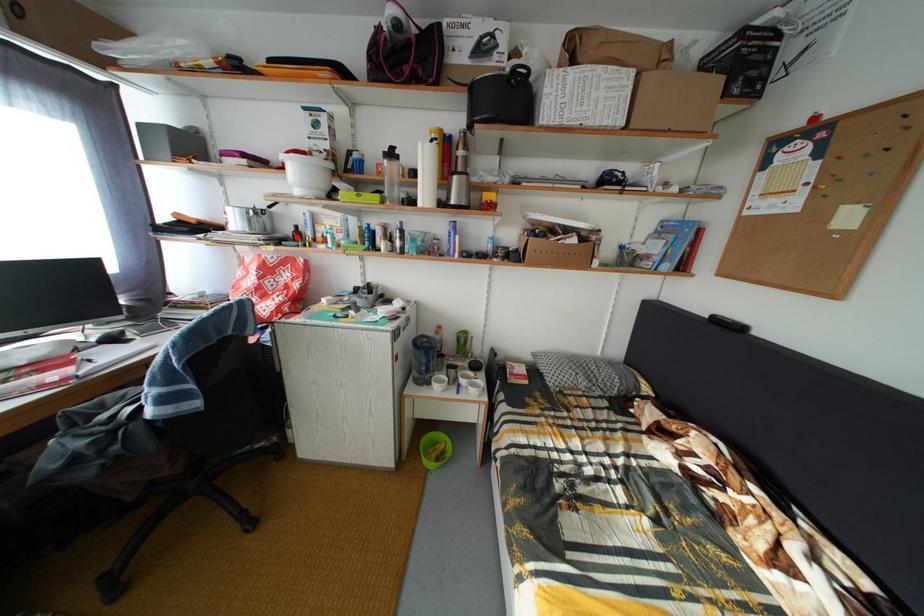
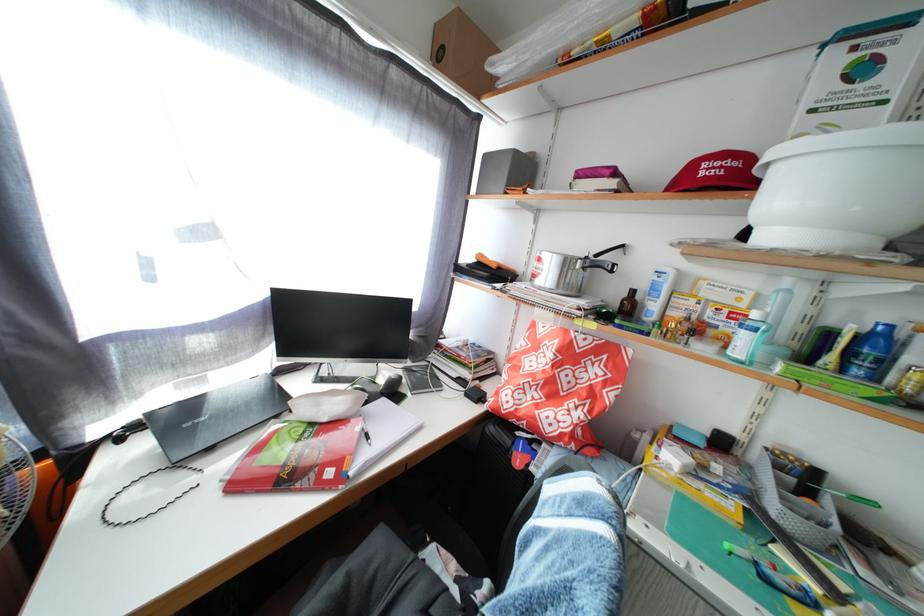
Locate, in the second image, the point that corresponds to the highlighted location in the first image.

(621, 301)